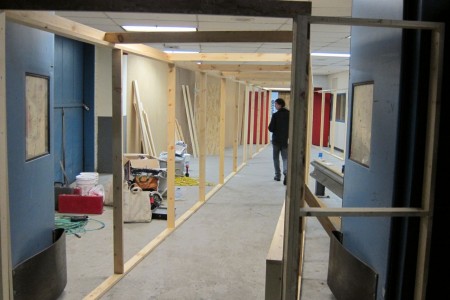
Locate an element on the screen. This screenshot has height=300, width=450. ceiling is located at coordinates (229, 25), (330, 9), (323, 41), (236, 48), (108, 23).